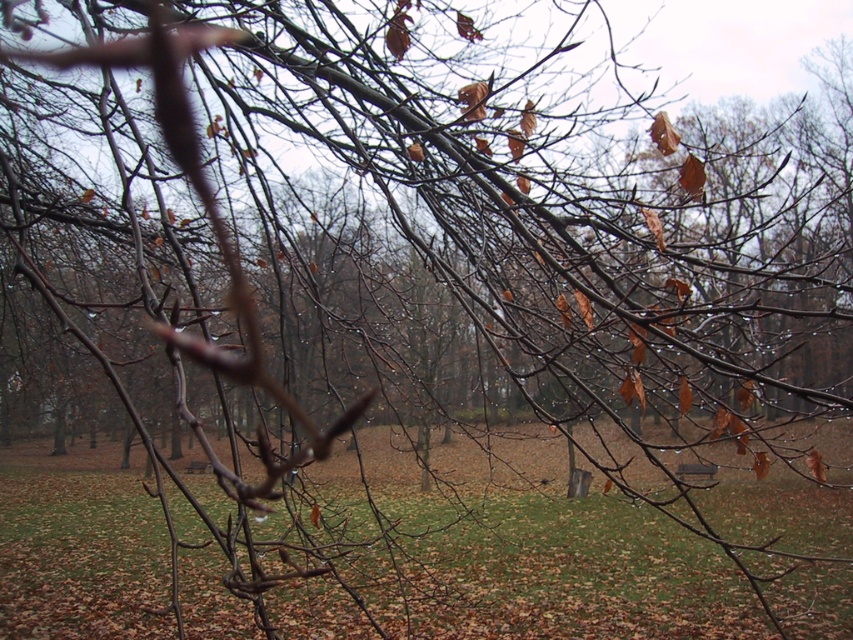
You are standing at the point marked as point (575, 576) in the image. What is the color of the ground beneath you?

The ground beneath you at point (575, 576) is green matte grass at center.

You are walking in the park and see the green matte grass at center and the wooden park bench at center. Which object is positioned to the left of the other?

The green matte grass at center is to the left of the wooden park bench at center.

You are a photographer setting up a tripod in the park. You want to capture a photo where the green matte grass at center is in focus while keeping the wooden park bench at center slightly out of focus. Is the grass closer to you than the bench?

Yes, the green matte grass at center is closer to the viewer than the wooden park bench at center, so focusing on the grass will naturally leave the bench slightly out of focus.